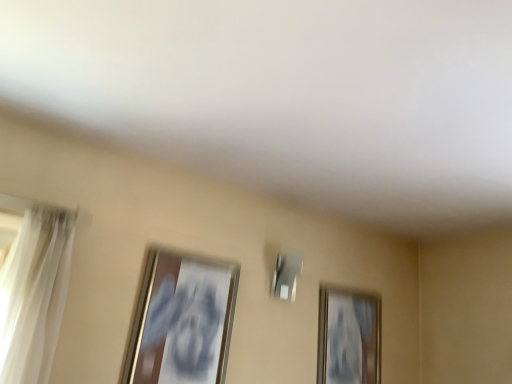
Question: Does white sheer curtain at left have a lesser width compared to metallic silver picture frame at left, the 2th picture frame from the right?

Choices:
 (A) yes
 (B) no

Answer: (B)

Question: Is white sheer curtain at left in front of metallic silver picture frame at left, arranged as the first picture frame when viewed from the front?

Choices:
 (A) yes
 (B) no

Answer: (A)

Question: Is white sheer curtain at left wider than metallic silver picture frame at left, the 2th picture frame from the back?

Choices:
 (A) no
 (B) yes

Answer: (B)

Question: From a real-world perspective, is white sheer curtain at left under metallic silver picture frame at left, the 2th picture frame from the back?

Choices:
 (A) no
 (B) yes

Answer: (A)

Question: Is metallic silver picture frame at left, the first picture frame positioned from the left, at the back of white sheer curtain at left?

Choices:
 (A) yes
 (B) no

Answer: (B)

Question: Is white sheer curtain at left to the left of metallic silver picture frame at left, the 2th picture frame from the right, from the viewer's perspective?

Choices:
 (A) no
 (B) yes

Answer: (B)

Question: From the image's perspective, is metallic silver picture frame at left, the 2th picture frame from the right, on white sheer curtain at left?

Choices:
 (A) no
 (B) yes

Answer: (A)

Question: Is metallic silver picture frame at left, arranged as the first picture frame when viewed from the front, at the right side of white sheer curtain at left?

Choices:
 (A) yes
 (B) no

Answer: (A)

Question: Does metallic silver picture frame at left, the first picture frame positioned from the left, have a smaller size compared to white sheer curtain at left?

Choices:
 (A) no
 (B) yes

Answer: (B)

Question: Is metallic silver picture frame at left, the 2th picture frame from the back, beside white sheer curtain at left?

Choices:
 (A) yes
 (B) no

Answer: (B)

Question: From a real-world perspective, is metallic silver picture frame at left, the 2th picture frame from the right, under white sheer curtain at left?

Choices:
 (A) no
 (B) yes

Answer: (B)

Question: Is metallic silver picture frame at left, the 2th picture frame from the right, behind white sheer curtain at left?

Choices:
 (A) no
 (B) yes

Answer: (B)

Question: Is white sheer curtain at left a part of gold metallic picture frame at upper right, which appears as the 1th picture frame when viewed from the right?

Choices:
 (A) no
 (B) yes

Answer: (A)